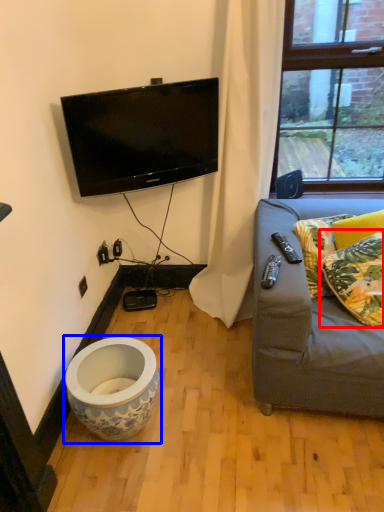
Question: Among these objects, which one is nearest to the camera, pillow (highlighted by a red box) or toilet (highlighted by a blue box)?

Choices:
 (A) pillow
 (B) toilet

Answer: (A)